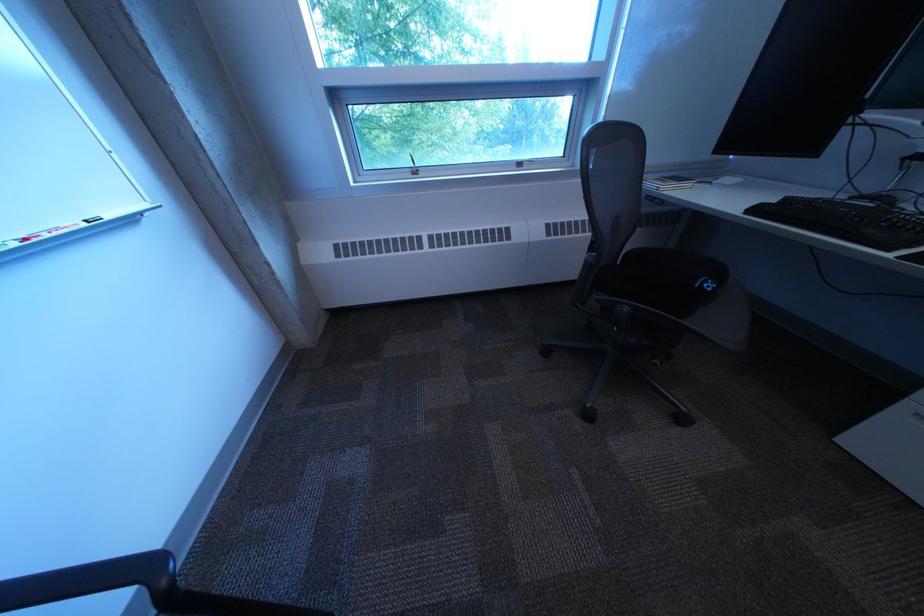
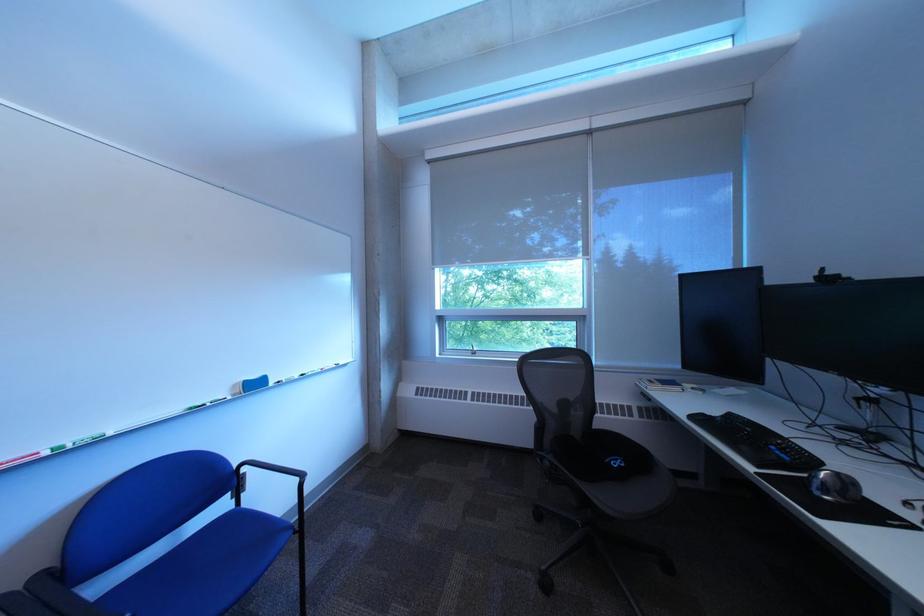
In the second image, find the point that corresponds to (x=640, y=310) in the first image.

(563, 464)